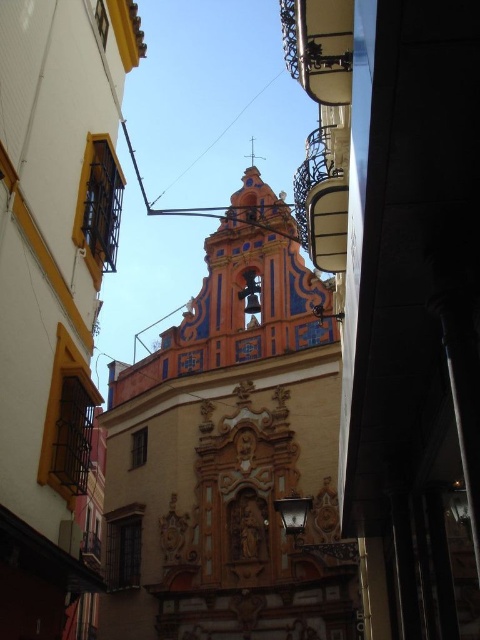
You are standing in the narrow urban alleyway and want to locate the orange painted stone church at center. According to the coordinates provided, where exactly should you look?

You should look at point 0.708 on the x axis and 0.481 on the y axis to find the orange painted stone church at center.

You are standing in an alleyway and see the orange painted stone church at center. If you want to take a closer look, how many steps would you need to take to reach the church if each step covers 2.5 feet?

The orange painted stone church at center is 155.72 feet away. Dividing the distance by the step length of 2.5 feet gives approximately 62.29 steps. Since you can only take whole steps, you would need to take 63 steps to reach the church.

You are standing in the narrow urban alleyway and see the point at coordinate (230,452). Which object is this point located on?

The point at coordinate (230,452) is located on the orange painted stone church at center.